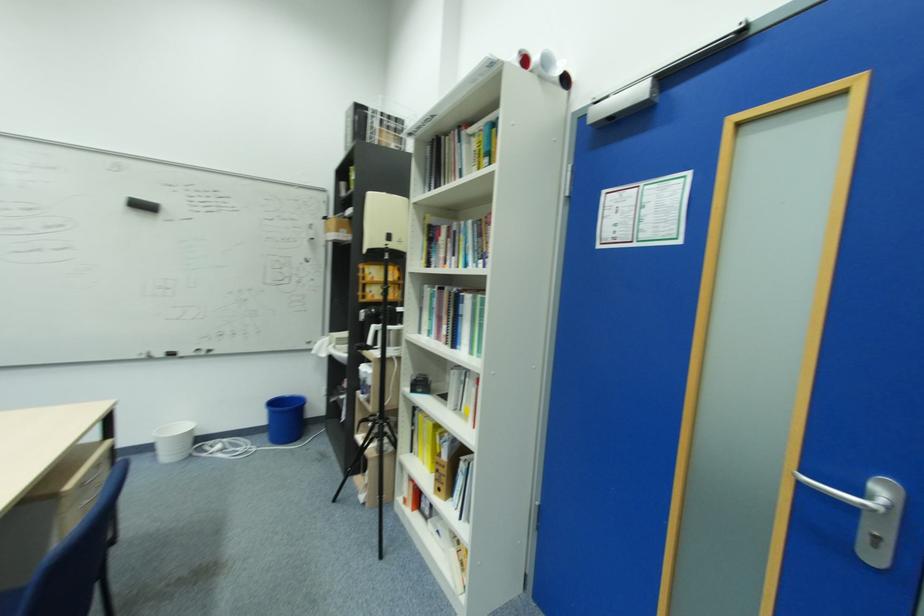
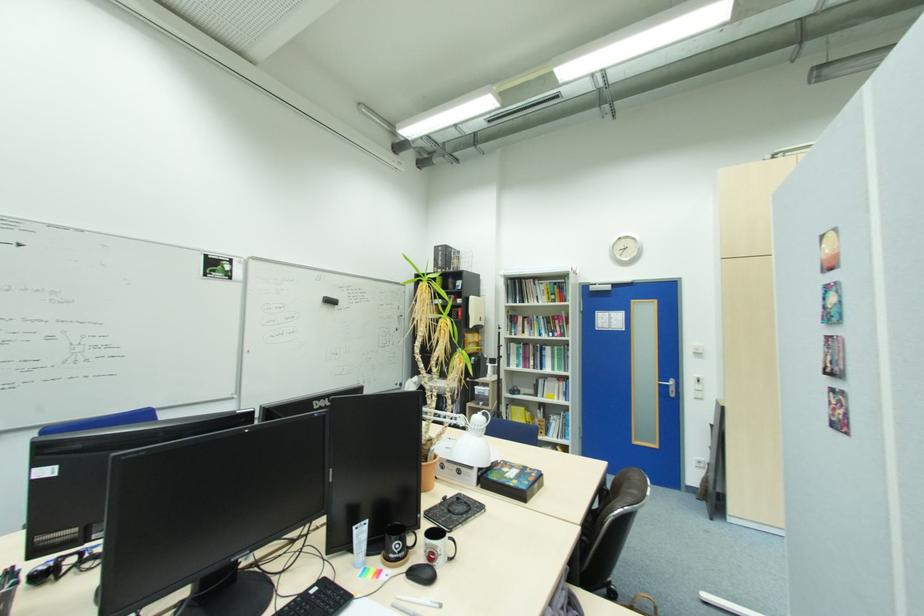
The point at (479,262) is marked in the first image. Where is the corresponding point in the second image?

(550, 334)